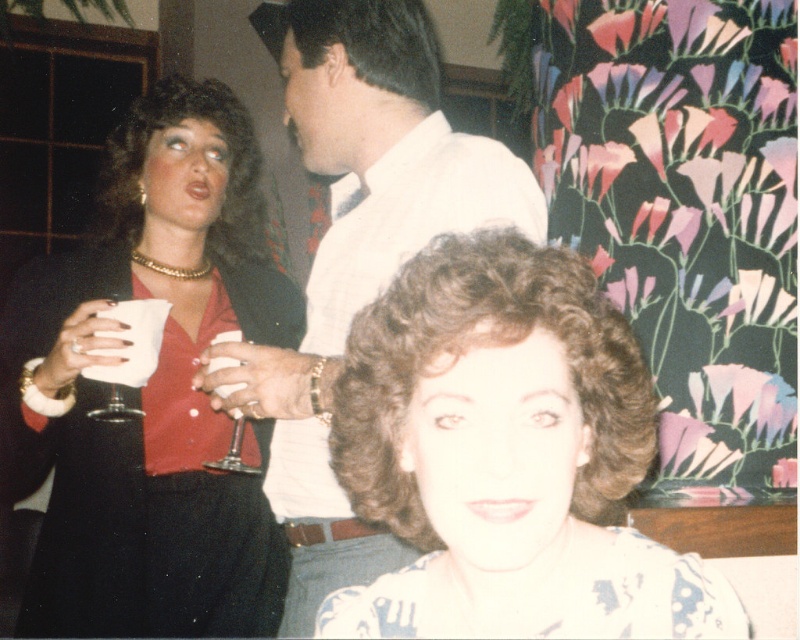
You are at point (388, 13) and want to move to point (90, 257). Is the path between these two points clear?

Point (90, 257) is behind point (388, 13), so the path between them is blocked by point (388, 13).

Based on the photo, you are standing in the room and want to locate the point at coordinates (152, 387). According to the scene description, where exactly would this point be located?

The point at coordinates (152, 387) is on the matte black dress at upper left.

You are at a social gathering and notice a white shirt at center and a clear glass wine glass at center. Which object is positioned to the right of the other?

The white shirt at center is to the right of the clear glass wine glass at center.